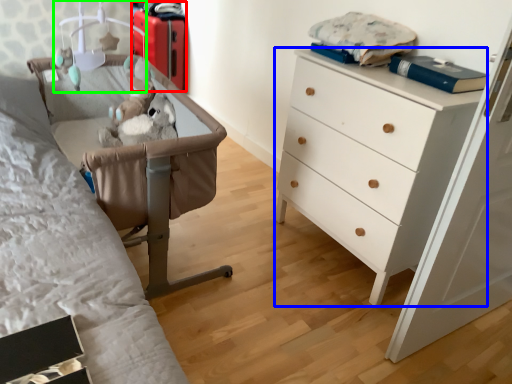
Question: Which object is the closest to the luggage (highlighted by a red box)? Choose among these: chest of drawers (highlighted by a blue box) or lamp (highlighted by a green box).

Choices:
 (A) chest of drawers
 (B) lamp

Answer: (B)